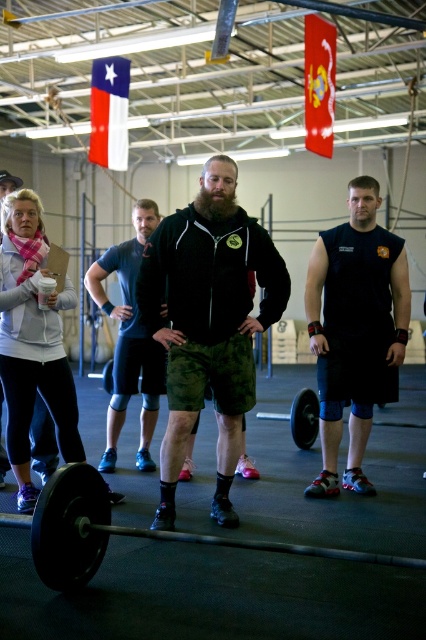
You are a photographer positioned at the entrance of the gym. You want to take a photo that includes both the black sleeveless shirt at right and the white fleece jacket at upper left. Which object should you focus on first to ensure both are in the frame?

You should focus on the black sleeveless shirt at right first because it is closer to you than the white fleece jacket at upper left, ensuring both will be in the frame when focused properly.

You are standing at the entrance of the gym and see the point marked at coordinates (123, 532). Which object in the gym is this point located on?

The point marked at coordinates (123, 532) is located on the black rubber barbell at center.

You are a gym trainer observing two participants wearing camouflage shorts at center and dark blue fabric shorts at center. Which participant has a larger pair of shorts?

The dark blue fabric shorts at center are larger than the camouflage shorts at center.